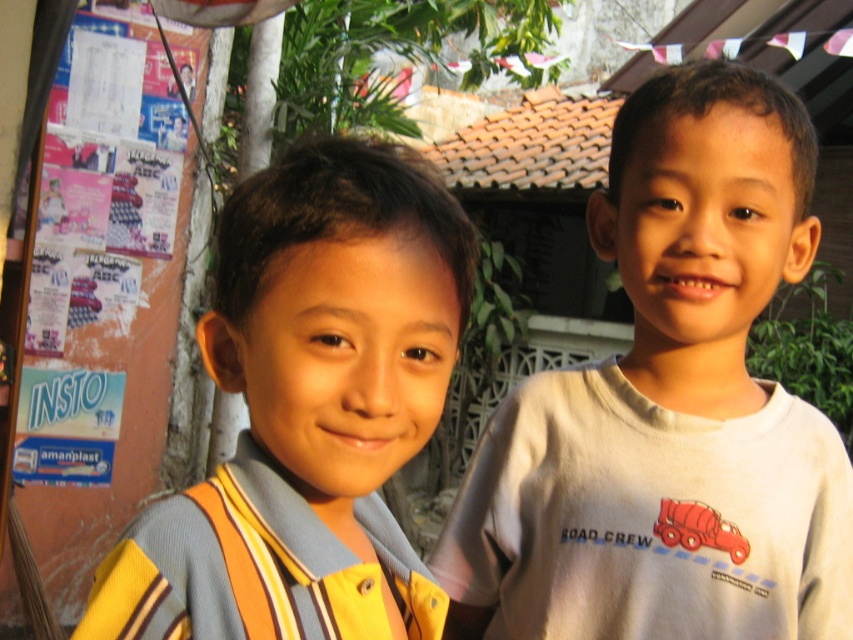
Looking at this image, you are a photographer trying to capture both the white cotton shirt at right and the yellow striped shirt at center in a single frame. Which shirt should you focus on first to ensure both are in focus, considering their sizes?

The white cotton shirt at right is bigger than the yellow striped shirt at center, so focusing on the larger white cotton shirt at right first will help ensure both shirts are in focus.

You are taking a photo of the two boys and need to focus on the yellow striped shirt at center and the orange paper posters at left. Which object is nearer to the camera?

The yellow striped shirt at center is closer to the viewer than orange paper posters at left, so the camera should focus on it first.